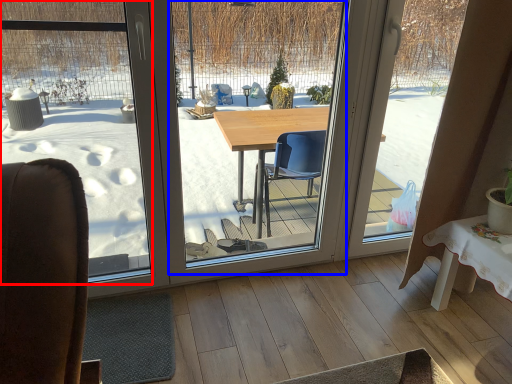
Question: Among these objects, which one is farthest to the camera, window screen (highlighted by a red box) or window screen (highlighted by a blue box)?

Choices:
 (A) window screen
 (B) window screen

Answer: (B)